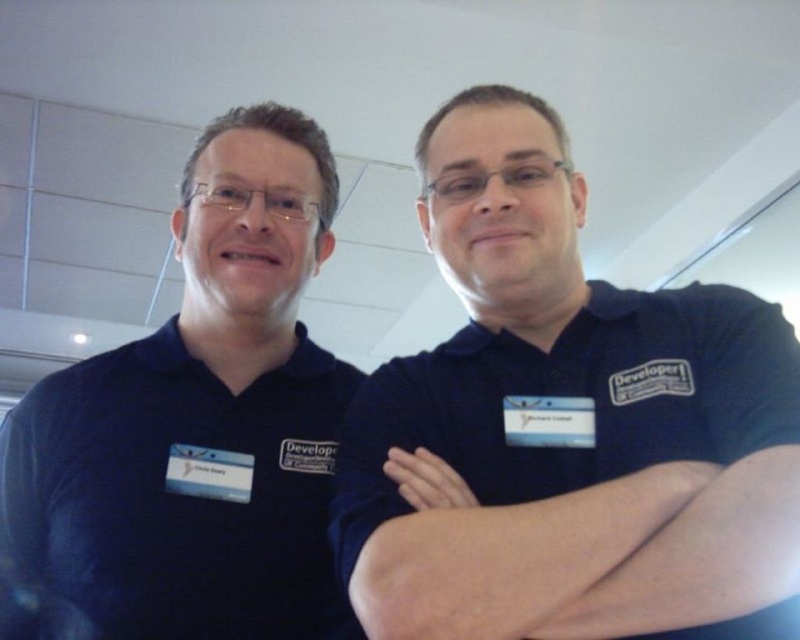
Question: Does dark blue shirt at center lie in front of dark blue shirt at left?

Choices:
 (A) no
 (B) yes

Answer: (B)

Question: Which point is farther from the camera taking this photo?

Choices:
 (A) (438, 225)
 (B) (214, 228)

Answer: (A)

Question: Is dark blue shirt at center bigger than dark blue shirt at left?

Choices:
 (A) yes
 (B) no

Answer: (A)

Question: Is dark blue shirt at center bigger than dark blue shirt at left?

Choices:
 (A) no
 (B) yes

Answer: (B)

Question: Which object appears farthest from the camera in this image?

Choices:
 (A) dark blue shirt at left
 (B) dark blue shirt at center

Answer: (A)